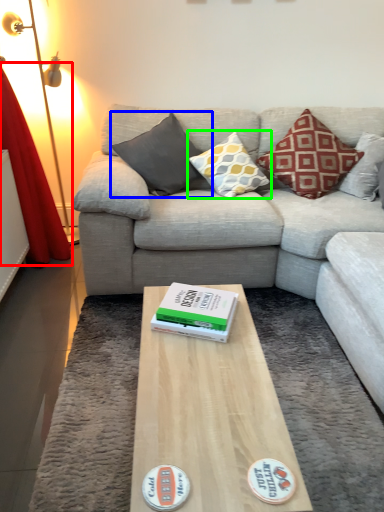
Question: Estimate the real-world distances between objects in this image. Which object is farther from curtain (highlighted by a red box), pillow (highlighted by a blue box) or pillow (highlighted by a green box)?

Choices:
 (A) pillow
 (B) pillow

Answer: (B)